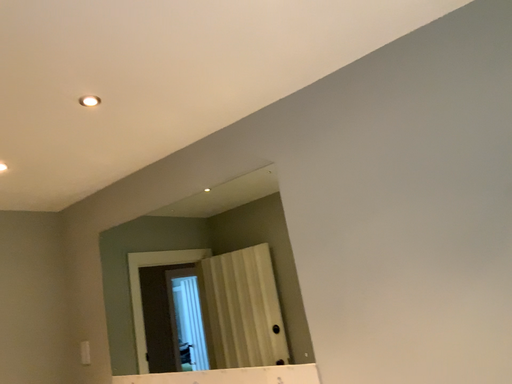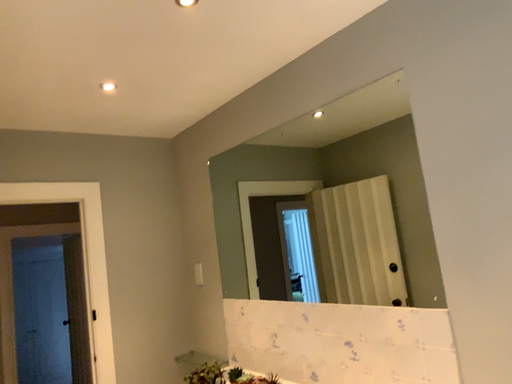
Question: How did the camera likely rotate when shooting the video?

Choices:
 (A) rotated right
 (B) rotated left

Answer: (B)